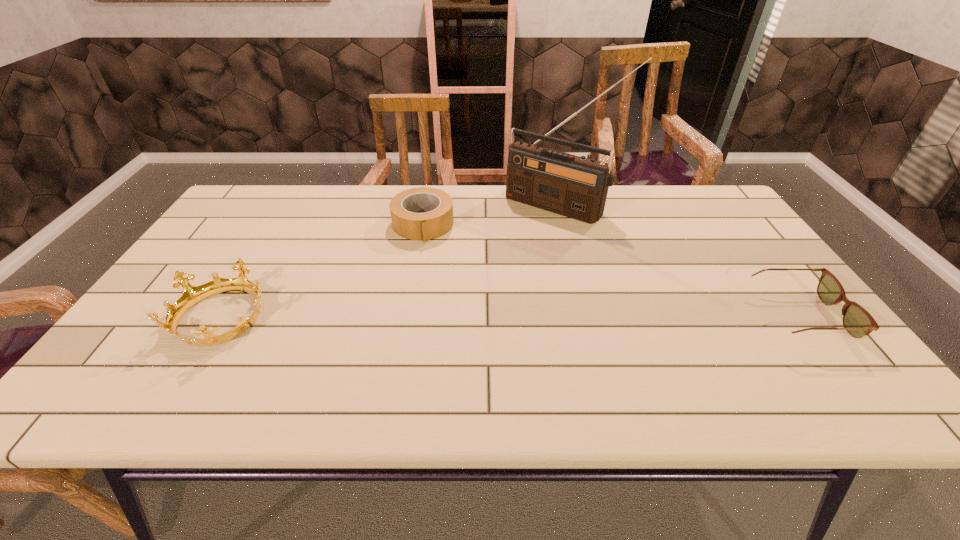
This screenshot has height=540, width=960. I want to click on free point located at the edge of the duct tape, so click(x=432, y=276).

Where is `free space located 0.270m at the edge of the duct tape`? free space located 0.270m at the edge of the duct tape is located at coordinates (439, 309).

What are the coordinates of `free space located 0.330m at the edge of the duct tape` in the screenshot? It's located at (442, 327).

Identify the location of radio receiver at the far edge. (576, 187).

Where is `duct tape located in the far edge section of the desktop`? The image size is (960, 540). duct tape located in the far edge section of the desktop is located at coordinates (423, 213).

I want to click on crown at the near edge, so click(192, 295).

Image resolution: width=960 pixels, height=540 pixels. Identify the location of spectacles at the near edge. (857, 321).

The width and height of the screenshot is (960, 540). I want to click on object located in the left edge section of the desktop, so click(192, 295).

Image resolution: width=960 pixels, height=540 pixels. What are the coordinates of `object at the right edge` in the screenshot? It's located at (857, 321).

Locate an element on the screen. object located in the near left corner section of the desktop is located at coordinates (192, 295).